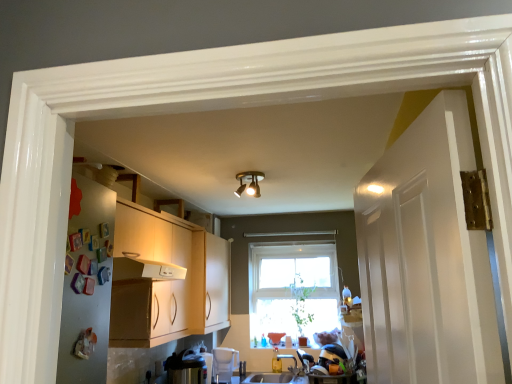
Question: From the image's perspective, is satin silver toaster at lower left, which is the 2th appliance from back to front, positioned above or below clear glass window at center?

Choices:
 (A) below
 (B) above

Answer: (A)

Question: In the image, is satin silver toaster at lower left, arranged as the second appliance when viewed from the right, on the left side or the right side of clear glass window at center?

Choices:
 (A) left
 (B) right

Answer: (A)

Question: Which object is the farthest from the gold metallic light fixture at center?

Choices:
 (A) smooth white countertop at lower center
 (B) satin silver toaster at lower left, which is the 2th appliance from back to front
 (C) matte wood cabinet at center
 (D) white plastic water filter at lower center, positioned as the 2th appliance in front-to-back order
 (E) clear glass window at center

Answer: (A)

Question: Based on their relative distances, which object is farther from the white plastic water filter at lower center, placed as the 1th appliance when sorted from back to front?

Choices:
 (A) smooth white countertop at lower center
 (B) matte wood cabinet at center
 (C) clear glass window at center
 (D) gold metallic light fixture at center
 (E) satin silver toaster at lower left, marked as the 1th appliance in a left-to-right arrangement

Answer: (D)